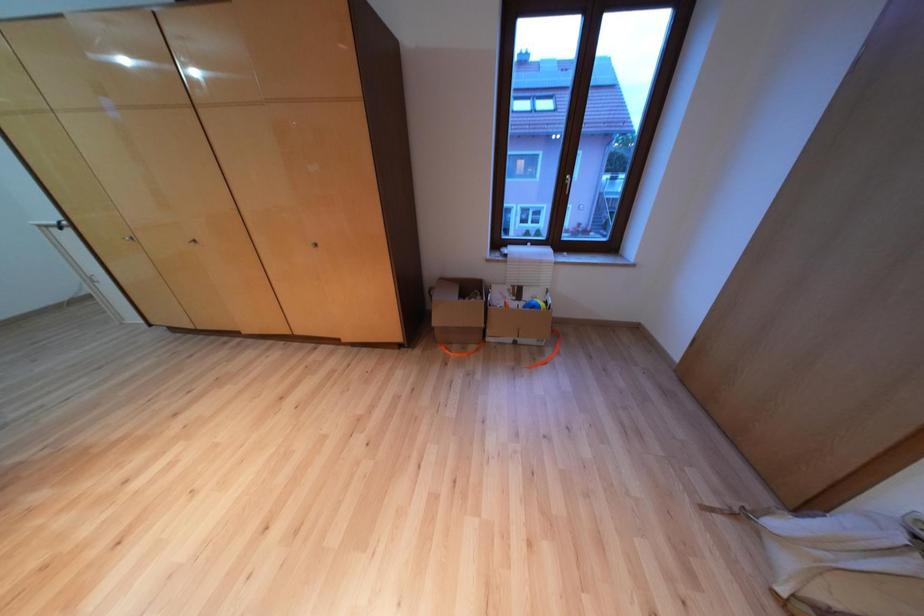
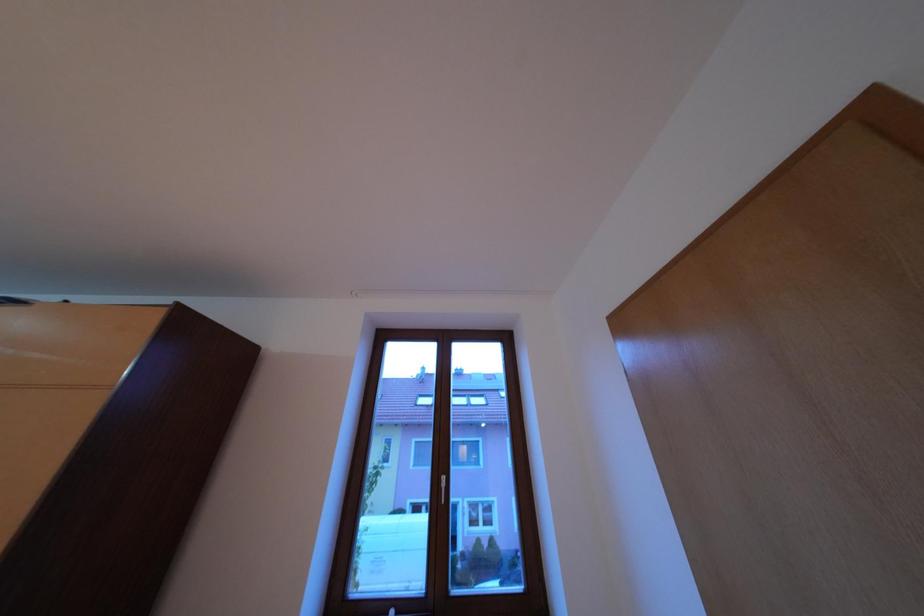
How did the camera likely rotate?

The camera's rotation is toward right-up.